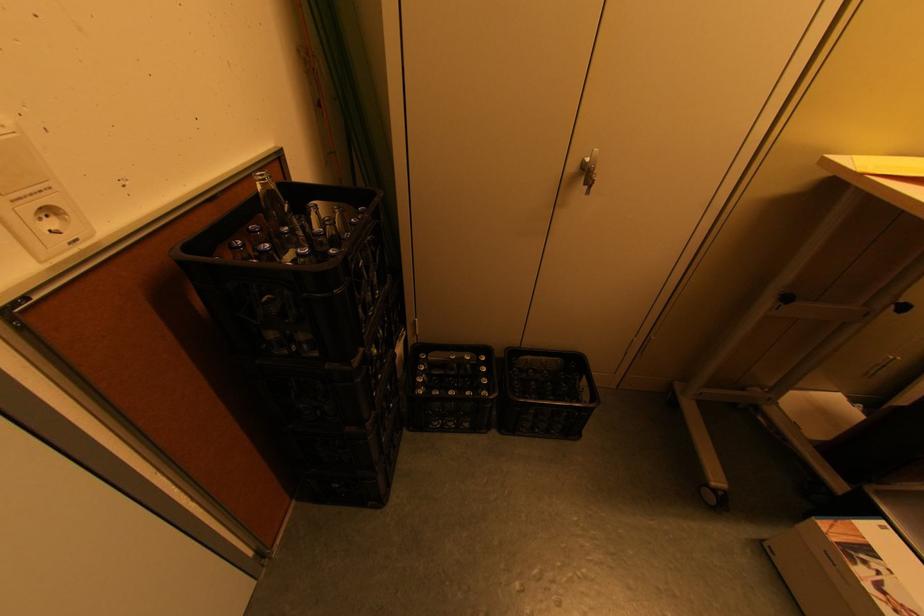
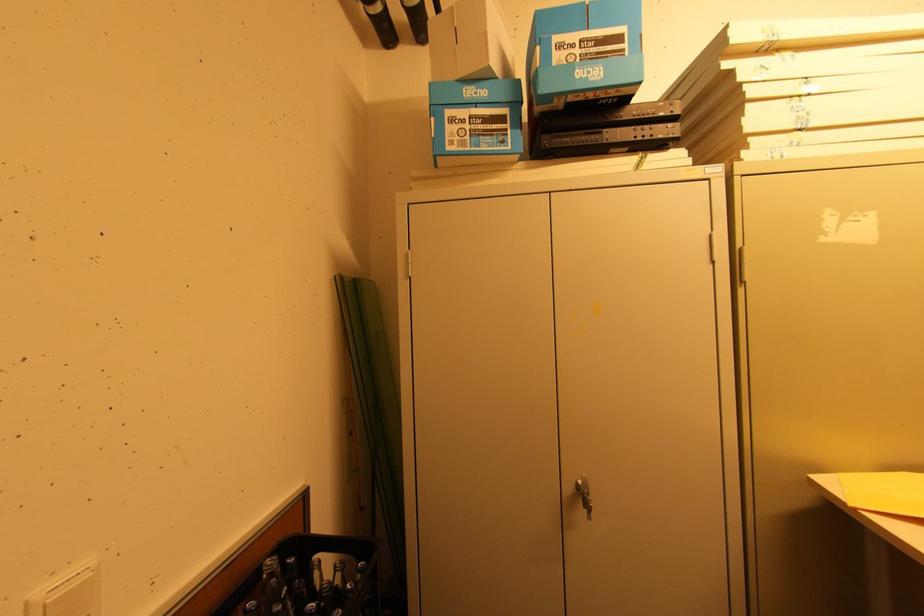
Find the pixel in the second image that matches point (262, 188) in the first image.

(268, 578)